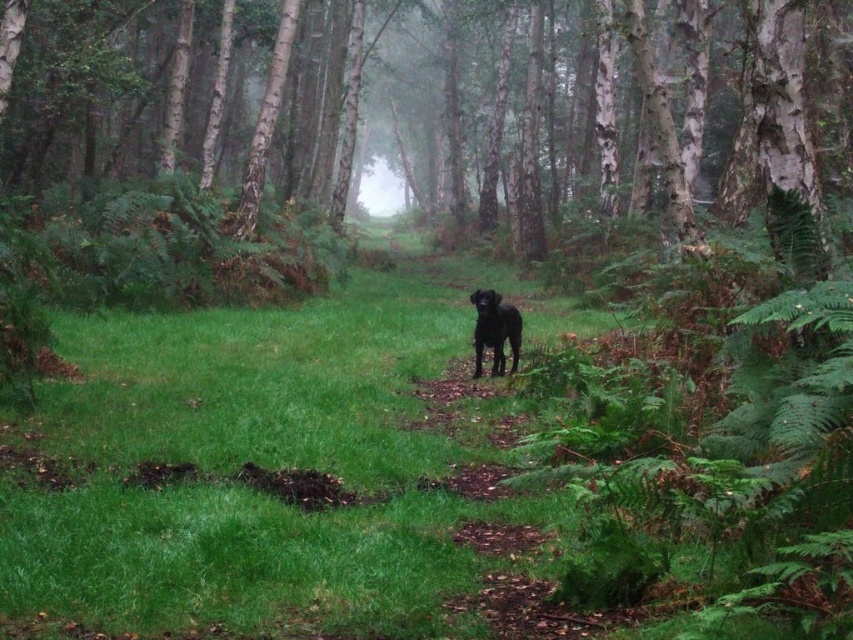
Question: Among these points, which one is nearest to the camera?

Choices:
 (A) (547, 61)
 (B) (111, 618)
 (C) (498, 355)

Answer: (B)

Question: Which object is closer to the camera taking this photo?

Choices:
 (A) shiny black dog at center
 (B) green grass at center
 (C) smooth bark trees at center

Answer: (B)

Question: Is green grass at center smaller than shiny black dog at center?

Choices:
 (A) no
 (B) yes

Answer: (A)

Question: Can you confirm if smooth bark trees at center is smaller than shiny black dog at center?

Choices:
 (A) yes
 (B) no

Answer: (B)

Question: Which point appears farthest from the camera in this image?

Choices:
 (A) (476, 301)
 (B) (19, 529)

Answer: (A)

Question: Is smooth bark trees at center below shiny black dog at center?

Choices:
 (A) no
 (B) yes

Answer: (A)